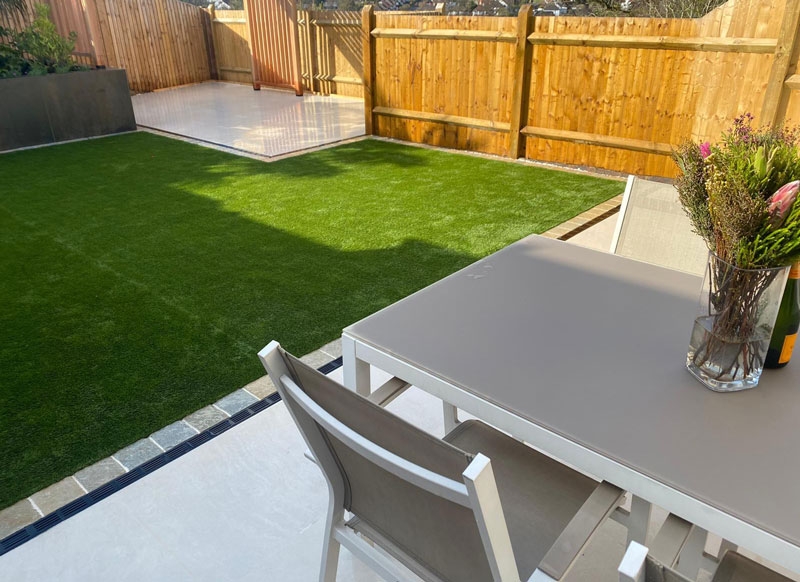
Where is `chair`? This screenshot has height=582, width=800. chair is located at coordinates (448, 496).